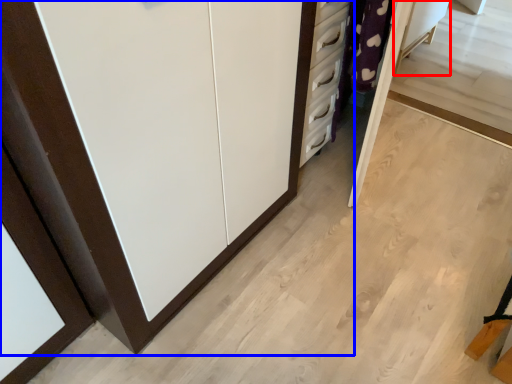
Question: Which point is closer to the camera, vanity (highlighted by a red box) or cupboard (highlighted by a blue box)?

Choices:
 (A) vanity
 (B) cupboard

Answer: (B)